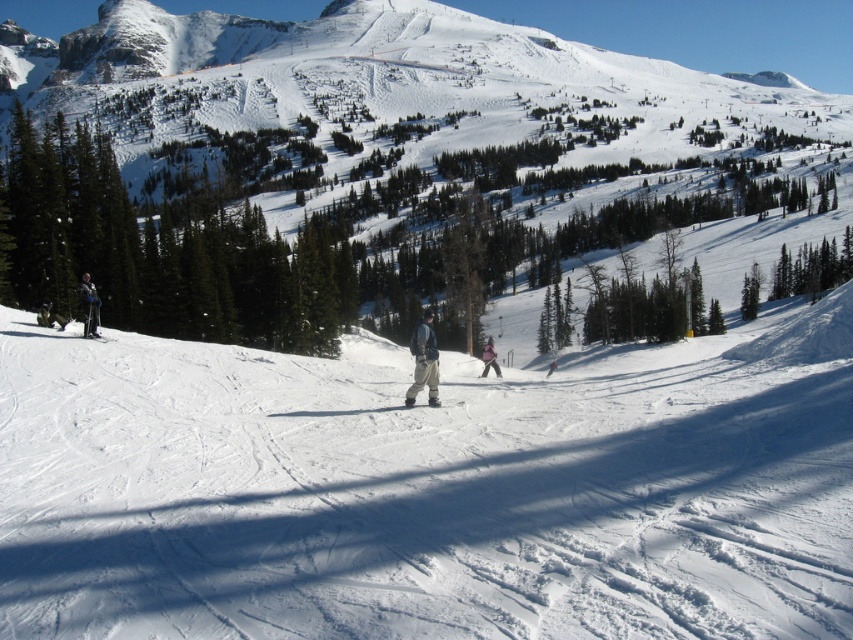
Does matte black skier at left appear over matte black ski at center?

Indeed, matte black skier at left is positioned over matte black ski at center.

Does matte black skier at left have a greater height compared to matte black ski at center?

Yes, matte black skier at left is taller than matte black ski at center.

Between point (90, 276) and point (434, 404), which one is positioned behind?

Positioned behind is point (90, 276).

The width and height of the screenshot is (853, 640). I want to click on matte black skier at left, so click(x=90, y=305).

Between gray fabric jacket at center and matte black ski at left, which one is positioned lower?

matte black ski at left is below.

Is gray fabric jacket at center taller than matte black ski at left?

Yes, gray fabric jacket at center is taller than matte black ski at left.

Describe the element at coordinates (424, 362) in the screenshot. I see `gray fabric jacket at center` at that location.

Locate an element on the screen. The width and height of the screenshot is (853, 640). gray fabric jacket at center is located at coordinates (424, 362).

Based on the photo, does pink fabric jacket at center have a larger size compared to matte black ski at center?

Yes.

Is point (498, 365) closer to camera compared to point (410, 401)?

No, it is not.

Does point (483, 364) lie behind point (431, 401)?

Yes, it is behind point (431, 401).

Where is `pink fabric jacket at center`? pink fabric jacket at center is located at coordinates (489, 358).